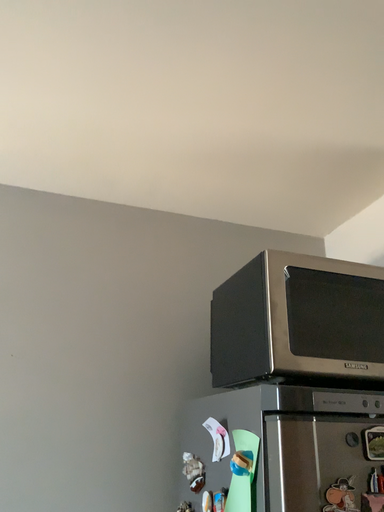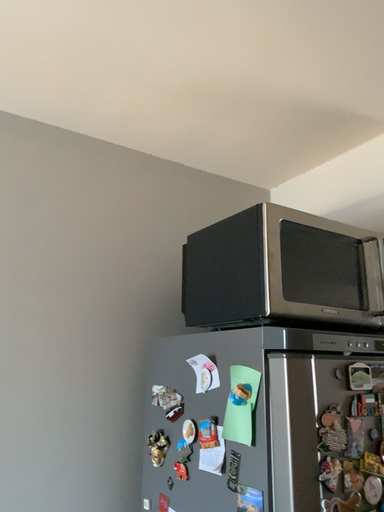
Question: How did the camera likely rotate when shooting the video?

Choices:
 (A) rotated downward
 (B) rotated upward

Answer: (A)